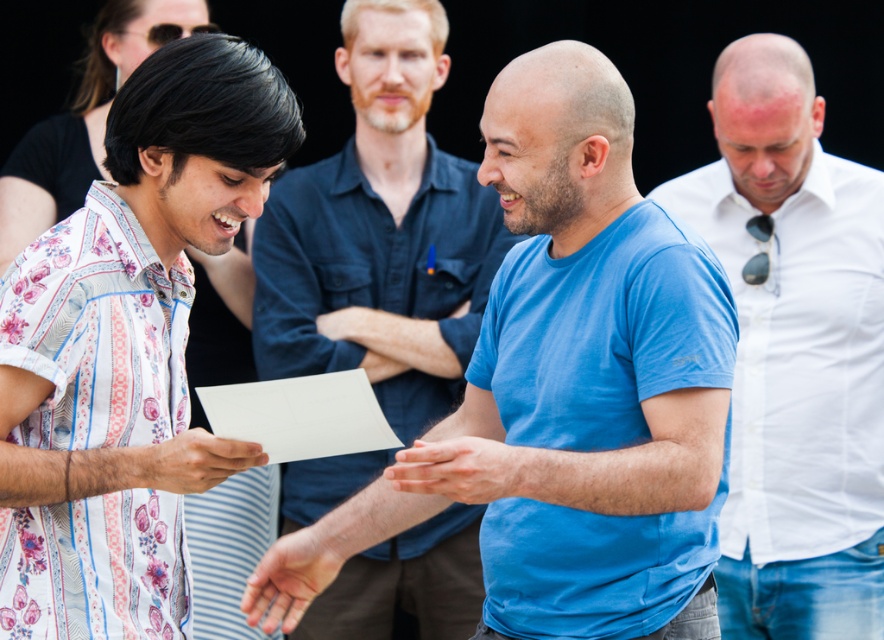
Question: Which object appears closest to the camera in this image?

Choices:
 (A) blue cotton shirt at center
 (B) white paper at center

Answer: (B)

Question: Estimate the real-world distances between objects in this image. Which object is farther from the printed cotton shirt at left?

Choices:
 (A) blue cotton t-shirt at center
 (B) floral-patterned fabric shirt at left

Answer: (A)

Question: Is blue cotton shirt at center to the left of white paper at center from the viewer's perspective?

Choices:
 (A) no
 (B) yes

Answer: (A)

Question: Which object is farther from the camera taking this photo?

Choices:
 (A) printed cotton shirt at left
 (B) blue cotton t-shirt at center
 (C) white cotton shirt at right

Answer: (C)

Question: Does blue cotton shirt at center have a greater width compared to floral-patterned fabric shirt at left?

Choices:
 (A) no
 (B) yes

Answer: (B)

Question: Can you confirm if printed cotton shirt at left is bigger than white paper at center?

Choices:
 (A) yes
 (B) no

Answer: (A)